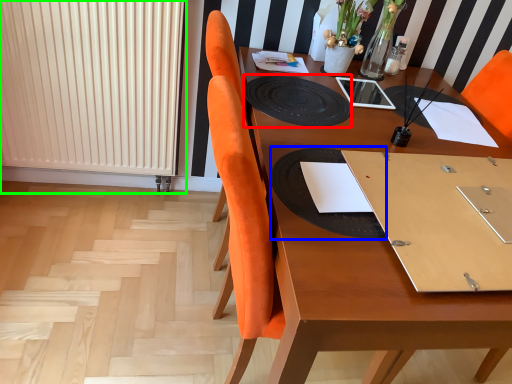
Question: Which object is positioned farthest from mat (highlighted by a red box)? Select from place mat (highlighted by a blue box) and radiator (highlighted by a green box).

Choices:
 (A) place mat
 (B) radiator

Answer: (B)